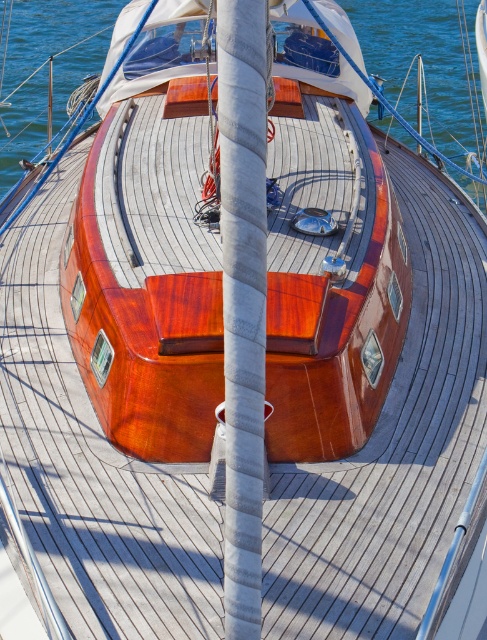
Question: Which point is closer to the camera?

Choices:
 (A) transparent blue water at center
 (B) white textured mast at center

Answer: (B)

Question: Can you confirm if white textured mast at center is positioned to the left of transparent blue water at center?

Choices:
 (A) no
 (B) yes

Answer: (A)

Question: Which of the following is the farthest from the observer?

Choices:
 (A) transparent blue water at center
 (B) white textured mast at center

Answer: (A)

Question: Observing the image, what is the correct spatial positioning of white textured mast at center in reference to transparent blue water at center?

Choices:
 (A) above
 (B) below

Answer: (B)

Question: From the image, what is the correct spatial relationship of white textured mast at center in relation to transparent blue water at center?

Choices:
 (A) above
 (B) below

Answer: (B)